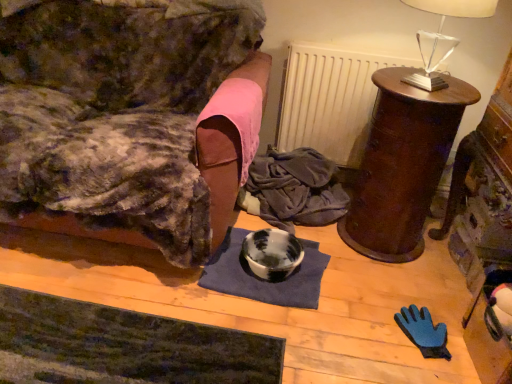
The height and width of the screenshot is (384, 512). In order to click on dark green textured yoga mat at lower left in this screenshot , I will do `click(123, 346)`.

This screenshot has height=384, width=512. What do you see at coordinates (442, 36) in the screenshot? I see `clear glass table lamp at upper right` at bounding box center [442, 36].

What do you see at coordinates (116, 110) in the screenshot? The image size is (512, 384). I see `velvet couch at left, the 1th furniture when ordered from left to right` at bounding box center [116, 110].

Where is `marbled ceramic bowl at center`? This screenshot has height=384, width=512. marbled ceramic bowl at center is located at coordinates pos(272,254).

Describe the element at coordinates (261, 280) in the screenshot. Image resolution: width=512 pixels, height=384 pixels. I see `blue fabric mat at center` at that location.

At what (x,y) coordinates should I click in order to perform the action: click on dark blue fabric at center. Please return your answer as a coordinate pair (x, y). Looking at the image, I should click on (294, 189).

From a real-world perspective, which is physically below, velvet couch at left, the 1th furniture when ordered from left to right, or dark blue fabric at center?

dark blue fabric at center, from a real-world perspective.

Does velvet couch at left, the 1th furniture when ordered from left to right, have a larger size compared to dark blue fabric at center?

Yes.

Would you say velvet couch at left, the 1th furniture when ordered from left to right, is inside or outside dark blue fabric at center?

velvet couch at left, the 1th furniture when ordered from left to right, is spatially situated outside dark blue fabric at center.

At what (x,y) coordinates should I click in order to perform the action: click on clothing below the velvet couch at left, the 1th furniture when ordered from left to right (from a real-world perspective). Please return your answer as a coordinate pair (x, y). The height and width of the screenshot is (384, 512). Looking at the image, I should click on (294, 189).

How much distance is there between marbled ceramic bowl at center and clear glass table lamp at upper right?

A distance of 94.37 centimeters exists between marbled ceramic bowl at center and clear glass table lamp at upper right.

Find the location of a particular element. The width and height of the screenshot is (512, 384). table lamp in front of the marbled ceramic bowl at center is located at coordinates (442, 36).

Does marbled ceramic bowl at center turn towards clear glass table lamp at upper right?

No, marbled ceramic bowl at center is not oriented towards clear glass table lamp at upper right.

Which of these two, marbled ceramic bowl at center or clear glass table lamp at upper right, is bigger?

clear glass table lamp at upper right.

Which of these two, marbled ceramic bowl at center or dark green textured yoga mat at lower left, is wider?

dark green textured yoga mat at lower left is wider.

Does marbled ceramic bowl at center have a smaller size compared to dark green textured yoga mat at lower left?

Yes, marbled ceramic bowl at center is smaller than dark green textured yoga mat at lower left.

Is marbled ceramic bowl at center taller or shorter than dark green textured yoga mat at lower left?

marbled ceramic bowl at center is taller than dark green textured yoga mat at lower left.

Between marbled ceramic bowl at center and dark green textured yoga mat at lower left, which one appears on the left side from the viewer's perspective?

From the viewer's perspective, dark green textured yoga mat at lower left appears more on the left side.

Does dark green textured yoga mat at lower left have a larger size compared to velvet couch at left, placed as the 2th furniture when sorted from right to left?

Incorrect, dark green textured yoga mat at lower left is not larger than velvet couch at left, placed as the 2th furniture when sorted from right to left.

Visually, is dark green textured yoga mat at lower left positioned to the left or to the right of velvet couch at left, the 1th furniture when ordered from left to right?

In the image, dark green textured yoga mat at lower left appears on the right side of velvet couch at left, the 1th furniture when ordered from left to right.

Is dark green textured yoga mat at lower left situated inside velvet couch at left, placed as the 2th furniture when sorted from right to left, or outside?

dark green textured yoga mat at lower left is not inside velvet couch at left, placed as the 2th furniture when sorted from right to left, it's outside.

Looking at this image, looking at their sizes, would you say dark blue fabric at center is wider or thinner than velvet couch at left, the 1th furniture when ordered from left to right?

Considering their sizes, dark blue fabric at center looks slimmer than velvet couch at left, the 1th furniture when ordered from left to right.

From the picture: Do you think dark blue fabric at center is within velvet couch at left, the 1th furniture when ordered from left to right, or outside of it?

dark blue fabric at center is spatially situated outside velvet couch at left, the 1th furniture when ordered from left to right.

From a real-world perspective, who is located higher, dark blue fabric at center or velvet couch at left, placed as the 2th furniture when sorted from right to left?

velvet couch at left, placed as the 2th furniture when sorted from right to left, from a real-world perspective.

How many degrees apart are the facing directions of dark blue fabric at center and velvet couch at left, the 1th furniture when ordered from left to right?

The angular difference between dark blue fabric at center and velvet couch at left, the 1th furniture when ordered from left to right, is 6.1 degrees.

Which of these two, blue fabric mat at center or marbled ceramic bowl at center, stands shorter?

blue fabric mat at center.

Looking at this image, how far apart are blue fabric mat at center and marbled ceramic bowl at center?

blue fabric mat at center and marbled ceramic bowl at center are 3.08 inches apart from each other.

Would you consider blue fabric mat at center to be distant from marbled ceramic bowl at center?

No, there isn't a large distance between blue fabric mat at center and marbled ceramic bowl at center.

Can you tell me how much blue fabric mat at center and marbled ceramic bowl at center differ in facing direction?

The angle between the facing direction of blue fabric mat at center and the facing direction of marbled ceramic bowl at center is 89.9 degrees.

At what (x,y) coordinates should I click in order to perform the action: click on bowl below the dark blue fabric at center (from the image's perspective). Please return your answer as a coordinate pair (x, y). The height and width of the screenshot is (384, 512). Looking at the image, I should click on (272, 254).

Based on the photo, can you confirm if dark blue fabric at center is bigger than marbled ceramic bowl at center?

Correct, dark blue fabric at center is larger in size than marbled ceramic bowl at center.

Would you say dark blue fabric at center contains marbled ceramic bowl at center?

No.

Is dark blue fabric at center to the left or to the right of marbled ceramic bowl at center in the image?

dark blue fabric at center is to the right of marbled ceramic bowl at center.

This screenshot has width=512, height=384. I want to click on furniture that is the 2nd object located in front of the dark blue fabric at center, so click(x=116, y=110).

I want to click on table lamp located above the marbled ceramic bowl at center (from the image's perspective), so click(442, 36).

Based on their spatial positions, is dark green textured yoga mat at lower left or velvet couch at left, placed as the 2th furniture when sorted from right to left, further from blue fabric mat at center?

velvet couch at left, placed as the 2th furniture when sorted from right to left, lies further to blue fabric mat at center than the other object.

Looking at the image, which one is located further to mahogany wood side table at right, which is the 2th furniture from left to right, clear glass table lamp at upper right or velvet couch at left, the 1th furniture when ordered from left to right?

Among the two, velvet couch at left, the 1th furniture when ordered from left to right, is located further to mahogany wood side table at right, which is the 2th furniture from left to right.

Estimate the real-world distances between objects in this image. Which object is closer to mahogany wood side table at right, which ranks as the first furniture in right-to-left order, dark green textured yoga mat at lower left or blue fabric mat at center?

The object closer to mahogany wood side table at right, which ranks as the first furniture in right-to-left order, is blue fabric mat at center.

In the scene shown: Looking at the image, which one is located closer to dark blue fabric at center, clear glass table lamp at upper right or marbled ceramic bowl at center?

marbled ceramic bowl at center is closer to dark blue fabric at center.

When comparing their distances from white matte radiator at upper center, does blue fabric mat at center or marbled ceramic bowl at center seem closer?

The object closer to white matte radiator at upper center is marbled ceramic bowl at center.

Considering their positions, is clear glass table lamp at upper right positioned closer to mahogany wood side table at right, which is the 2th furniture from left to right, than marbled ceramic bowl at center?

The object closer to mahogany wood side table at right, which is the 2th furniture from left to right, is clear glass table lamp at upper right.

From the picture: Which object lies nearer to the anchor point dark blue fabric at center, clear glass table lamp at upper right or blue fabric mat at center?

The object closer to dark blue fabric at center is blue fabric mat at center.

Looking at the image, which one is located closer to velvet couch at left, placed as the 2th furniture when sorted from right to left, mahogany wood side table at right, which ranks as the first furniture in right-to-left order, or clear glass table lamp at upper right?

Based on the image, mahogany wood side table at right, which ranks as the first furniture in right-to-left order, appears to be nearer to velvet couch at left, placed as the 2th furniture when sorted from right to left.

Identify the location of clothing located between blue fabric mat at center and mahogany wood side table at right, which is the 2th furniture from left to right, in the left-right direction. (294, 189).

Where is `clothing between velvet couch at left, the 1th furniture when ordered from left to right, and white matte radiator at upper center from left to right`? The width and height of the screenshot is (512, 384). clothing between velvet couch at left, the 1th furniture when ordered from left to right, and white matte radiator at upper center from left to right is located at coordinates (294, 189).

Identify the location of radiator between mahogany wood side table at right, which ranks as the first furniture in right-to-left order, and dark blue fabric at center in the front-back direction. [x=330, y=99].

This screenshot has height=384, width=512. I want to click on mat between velvet couch at left, the 1th furniture when ordered from left to right, and mahogany wood side table at right, which is the 2th furniture from left to right, from left to right, so click(x=261, y=280).